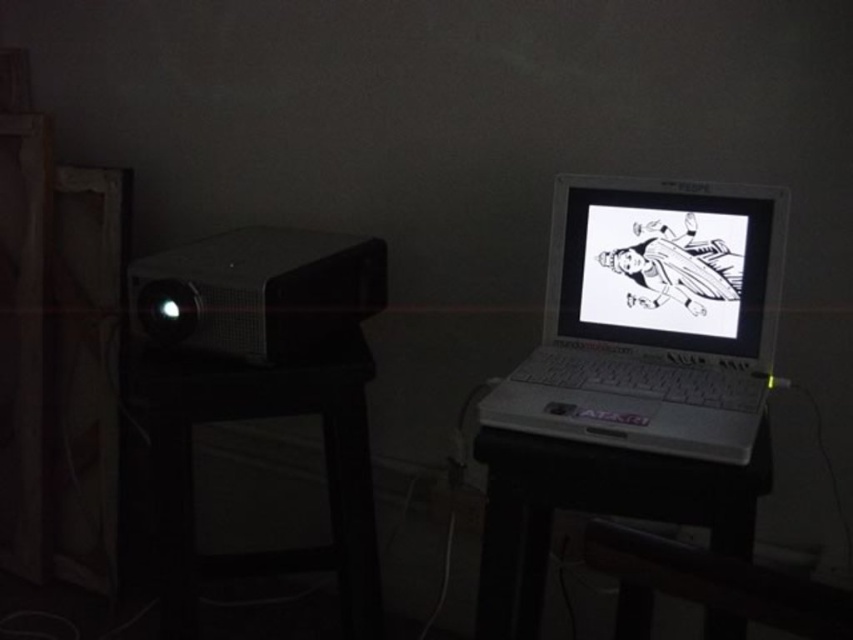
Is white glossy screen at center behind white plastic table at center?

That is True.

Is white glossy screen at center below white plastic table at center?

Actually, white glossy screen at center is above white plastic table at center.

Find the location of a particular element. This screenshot has height=640, width=853. white glossy screen at center is located at coordinates (665, 268).

Locate an element on the screen. The width and height of the screenshot is (853, 640). white glossy screen at center is located at coordinates (665, 268).

Is white plastic laptop at upper right above white plastic table at center?

Yes, white plastic laptop at upper right is above white plastic table at center.

This screenshot has height=640, width=853. What do you see at coordinates (653, 317) in the screenshot?
I see `white plastic laptop at upper right` at bounding box center [653, 317].

Find the location of `white plastic laptop at upper right`. white plastic laptop at upper right is located at coordinates point(653,317).

Is white plastic laptop at upper right further to camera compared to white glossy screen at center?

No, it is not.

Does white plastic laptop at upper right appear on the right side of white glossy screen at center?

No, white plastic laptop at upper right is not to the right of white glossy screen at center.

Does point (708, 269) come farther from viewer compared to point (595, 324)?

No, it is in front of (595, 324).

Find the location of `white plastic laptop at upper right`. white plastic laptop at upper right is located at coordinates (653, 317).